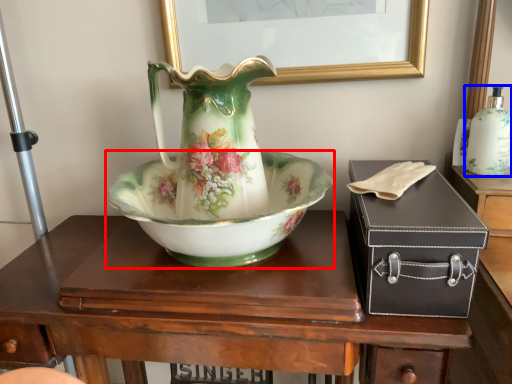
Question: Among these objects, which one is nearest to the camera, bowl (highlighted by a red box) or bottle (highlighted by a blue box)?

Choices:
 (A) bowl
 (B) bottle

Answer: (A)